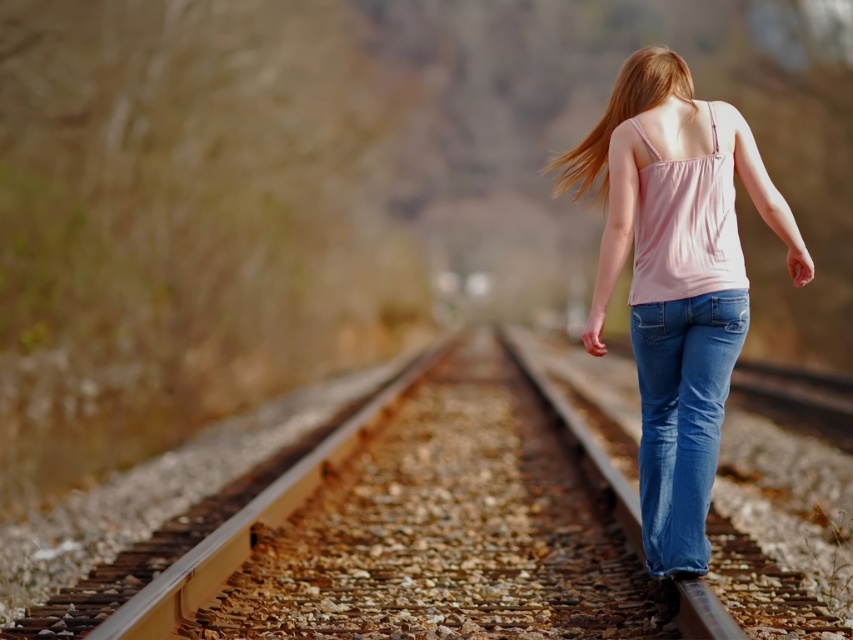
Question: Which is nearer to the pink cotton tank top at center?

Choices:
 (A) blonde silky hair at center
 (B) blue denim jeans at center

Answer: (B)

Question: From the image, what is the correct spatial relationship of brown gravel train track at center in relation to pink fabric tank top at center?

Choices:
 (A) below
 (B) above

Answer: (A)

Question: Which object is closer to the camera taking this photo?

Choices:
 (A) pink fabric tank top at center
 (B) pink cotton tank top at center
 (C) blonde silky hair at center
 (D) blue denim jeans at center

Answer: (B)

Question: In this image, where is pink cotton tank top at center located relative to blonde silky hair at center?

Choices:
 (A) left
 (B) right

Answer: (B)

Question: Among these objects, which one is nearest to the camera?

Choices:
 (A) pink fabric tank top at center
 (B) blue denim jeans at center
 (C) blonde silky hair at center

Answer: (B)

Question: Is blue denim jeans at center to the left of blonde silky hair at center from the viewer's perspective?

Choices:
 (A) yes
 (B) no

Answer: (B)